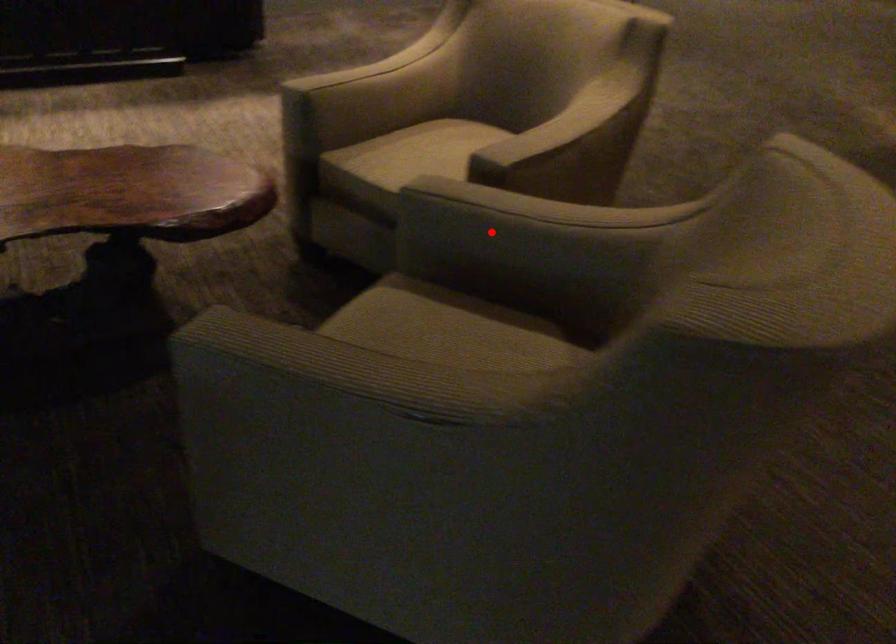
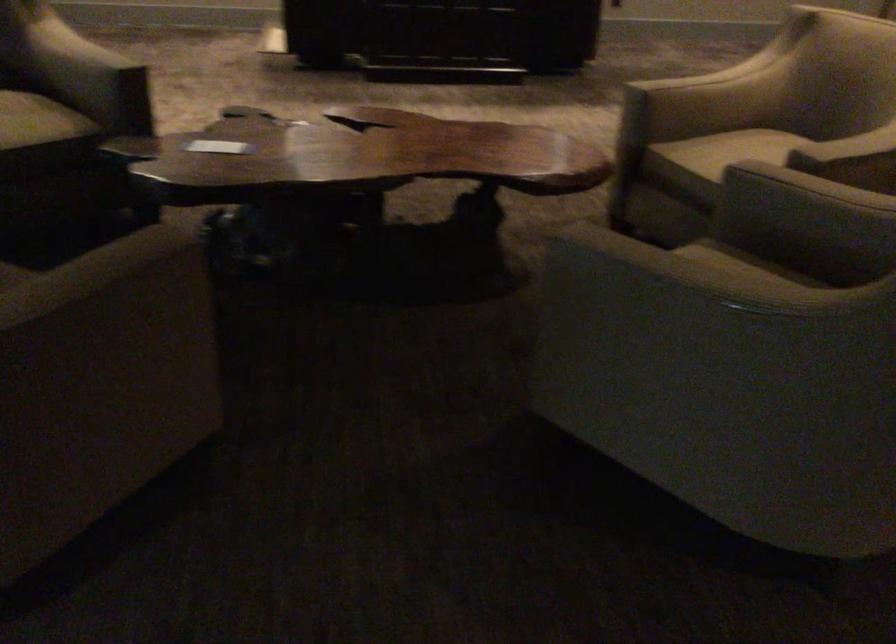
Question: I am providing you with two images of the same scene from different viewpoints. In image1, a red point is highlighted. Considering the same 3D point in image2, which of the following is correct?

Choices:
 (A) It is closer
 (B) It is farther

Answer: (B)